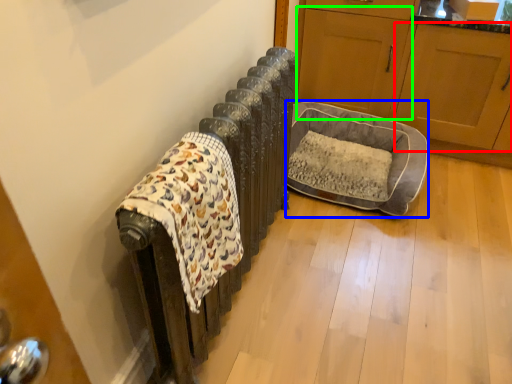
Question: Which object is positioned closest to screen door (highlighted by a red box)? Select from dog bed (highlighted by a blue box) and screen door (highlighted by a green box).

Choices:
 (A) dog bed
 (B) screen door

Answer: (B)